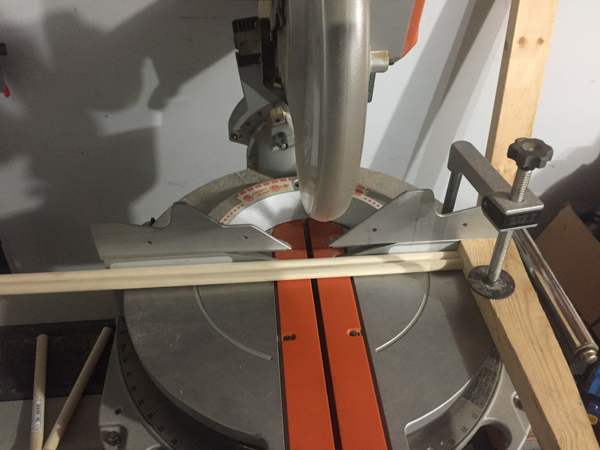
At what (x,y) coordinates should I click in order to perform the action: click on box. Please return your answer as a coordinate pair (x, y). The width and height of the screenshot is (600, 450). Looking at the image, I should click on (590, 255).